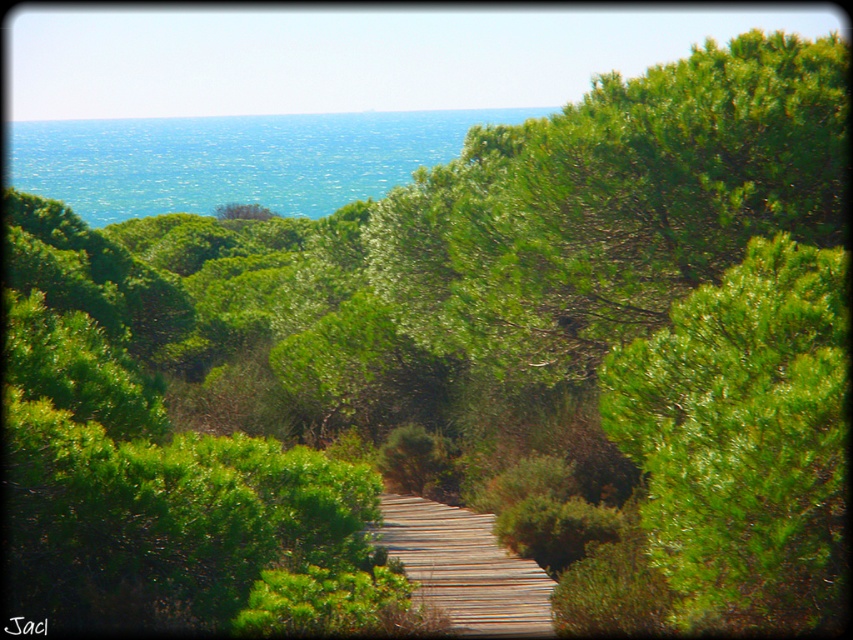
Which is more to the right, green leafy tree at upper right or wooden at center?

green leafy tree at upper right is more to the right.

Between green leafy tree at upper right and wooden at center, which one is positioned higher?

green leafy tree at upper right is higher up.

Which is behind, point (821, 484) or point (495, 538)?

Point (495, 538)

Locate an element on the screen. Image resolution: width=853 pixels, height=640 pixels. green leafy tree at upper right is located at coordinates (744, 440).